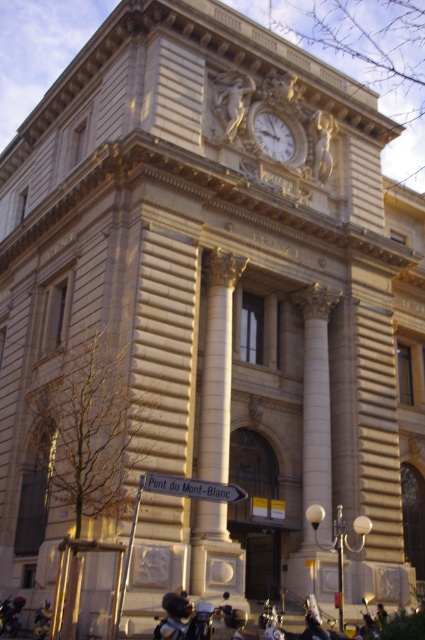
Is point (218, 364) positioned behind point (189, 627)?

Yes, it is.

Does golden stone column at center lie in front of shiny black motorcycle at lower center?

→ No, it is not.

Identify the location of golden stone column at center. (217, 364).

The image size is (425, 640). I want to click on golden stone column at center, so click(x=217, y=364).

Can you confirm if shiny black motorcycle at lower center is shorter than shiny black motorcycle at lower left?

Incorrect, shiny black motorcycle at lower center's height does not fall short of shiny black motorcycle at lower left's.

In the scene shown: Between shiny black motorcycle at lower center and shiny black motorcycle at lower left, which one appears on the left side from the viewer's perspective?

shiny black motorcycle at lower left

Does point (184, 602) come behind point (11, 628)?

No, (184, 602) is in front of (11, 628).

Locate an element on the screen. The height and width of the screenshot is (640, 425). shiny black motorcycle at lower center is located at coordinates (184, 618).

Which of these two, golden stone column at center or shiny black motorcycle at lower left, stands taller?

golden stone column at center

Who is shorter, golden stone column at center or shiny black motorcycle at lower left?

shiny black motorcycle at lower left

Who is more distant from viewer, (243, 596) or (20, 595)?

Point (20, 595)

Find the location of a particular element. golden stone column at center is located at coordinates (217, 364).